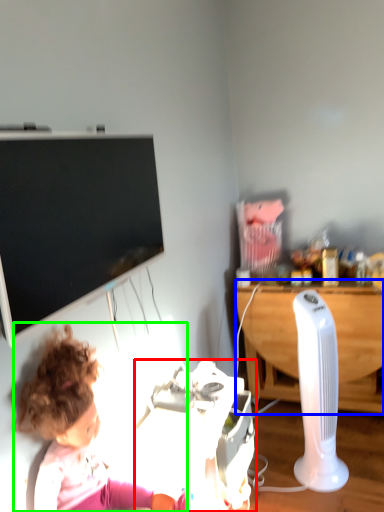
Question: Estimate the real-world distances between objects in this image. Which object is farther from equipment (highlighted by a red box), desk (highlighted by a blue box) or person (highlighted by a green box)?

Choices:
 (A) desk
 (B) person

Answer: (A)